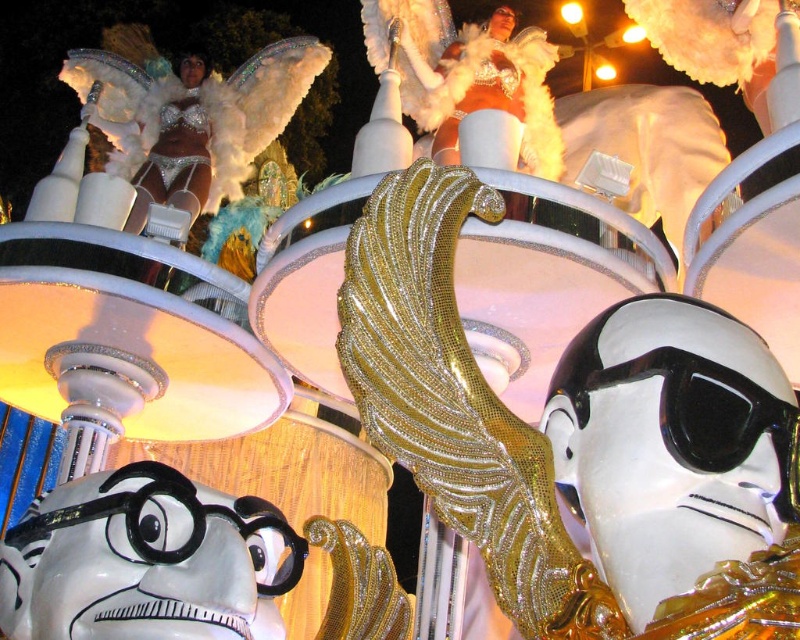
Question: Which of the following is the farthest from the observer?

Choices:
 (A) white feather wings at upper left
 (B) black glossy goggles at center

Answer: (A)

Question: Does gold glittery wing at center have a greater width compared to black glossy goggles at center?

Choices:
 (A) yes
 (B) no

Answer: (A)

Question: Which object is the closest to the gold glittery wing at center?

Choices:
 (A) white feather wings at upper left
 (B) black glossy goggles at center

Answer: (B)

Question: Can you confirm if white feather wings at upper left is positioned to the left of black glossy goggles at center?

Choices:
 (A) no
 (B) yes

Answer: (B)

Question: Is the position of white feather wings at upper left less distant than that of black glossy goggles at center?

Choices:
 (A) yes
 (B) no

Answer: (B)

Question: Which object is positioned farthest from the black glossy goggles at center?

Choices:
 (A) gold glittery wing at center
 (B) white feather wings at upper left

Answer: (B)